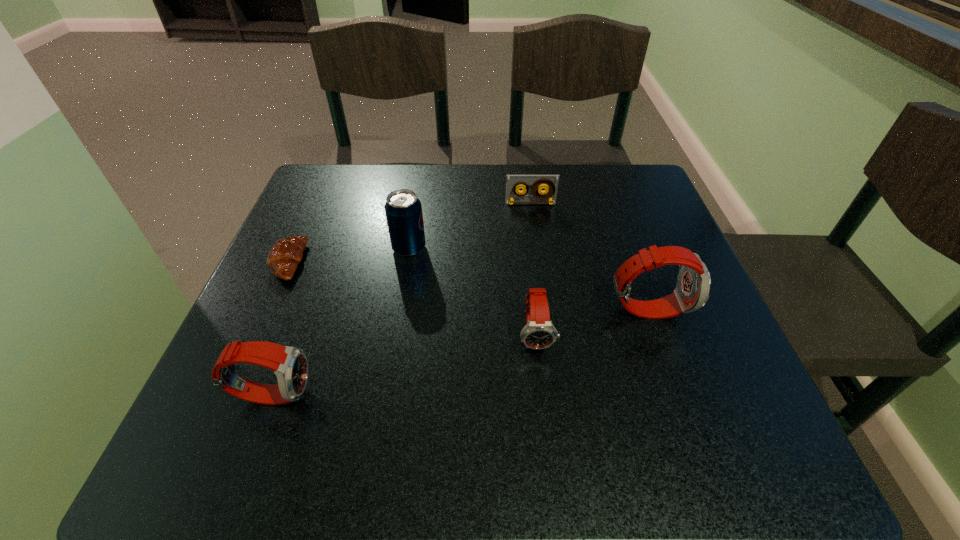
In order to click on empty space that is in between the farthest object and the tallest watch in this screenshot , I will do `click(588, 256)`.

Find the location of a particular element. This screenshot has width=960, height=540. free space between the soda can and the rightmost watch is located at coordinates (528, 279).

Locate an element on the screen. free space between the nearest watch and the second shortest object is located at coordinates pyautogui.click(x=401, y=299).

You are a GUI agent. You are given a task and a screenshot of the screen. Output one action in this format:
    pyautogui.click(x=<x>, y=<y>)
    Task: Click on the blank region between the tallest watch and the second watch from right to left
    This screenshot has height=540, width=960.
    Given the screenshot: What is the action you would take?
    pyautogui.click(x=591, y=322)

At what (x,y) coordinates should I click in order to perform the action: click on unoccupied position between the second shortest object and the leftmost watch. Please return your answer as a coordinate pair (x, y). This screenshot has height=540, width=960. Looking at the image, I should click on (x=401, y=299).

Locate an element on the screen. free area in between the shortest object and the tallest watch is located at coordinates (468, 286).

Find the location of `free area in between the crescent roll and the second watch from right to left`. free area in between the crescent roll and the second watch from right to left is located at coordinates (412, 298).

Find the location of `object that can be found as the fifth closest to the rightmost watch`. object that can be found as the fifth closest to the rightmost watch is located at coordinates (285, 255).

Locate which object ranks third in proximity to the crescent roll. Please provide its 2D coordinates. Your answer should be formatted as a tuple, i.e. [(x, y)], where the tuple contains the x and y coordinates of a point satisfying the conditions above.

[(539, 332)]

Point out which watch is positioned as the nearest to the fourth object from right to left. Please provide its 2D coordinates. Your answer should be formatted as a tuple, i.e. [(x, y)], where the tuple contains the x and y coordinates of a point satisfying the conditions above.

[(539, 332)]